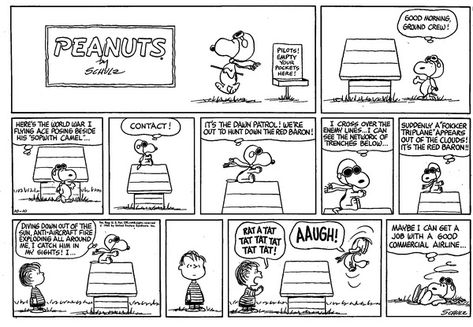
At what (x,y) coordinates should I click in order to perform the action: click on frames of the peanuts comic. Please return your answer as a coordinate pair (x, y). Image resolution: width=473 pixels, height=327 pixels. Looking at the image, I should click on (390, 64), (38, 160), (169, 156), (250, 162), (353, 163), (434, 170), (422, 248), (330, 261), (200, 250), (122, 254).